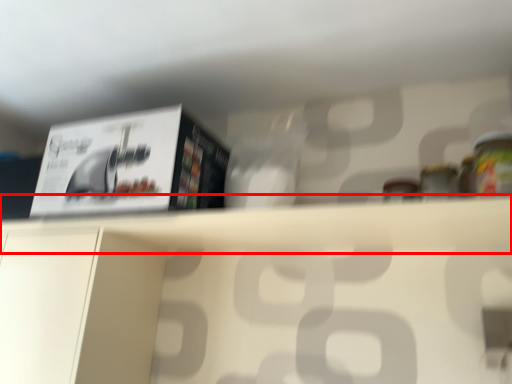
Question: From the image's perspective, where is shelf (annotated by the red box) located relative to paperback book?

Choices:
 (A) below
 (B) above

Answer: (A)